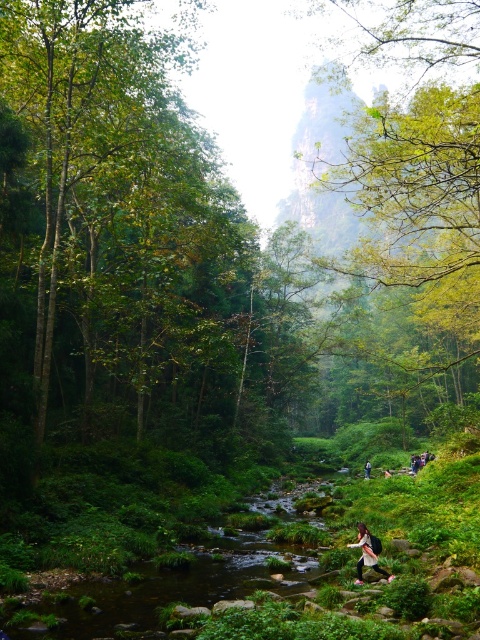
Question: Can you confirm if dark brown leather backpack at lower center is bigger than dark blue jeans at lower center?

Choices:
 (A) yes
 (B) no

Answer: (B)

Question: Among these points, which one is nearest to the camera?

Choices:
 (A) (363, 547)
 (B) (368, 477)

Answer: (A)

Question: Considering the relative positions of dark brown leather backpack at lower center and dark blue jeans at lower center in the image provided, where is dark brown leather backpack at lower center located with respect to dark blue jeans at lower center?

Choices:
 (A) below
 (B) above

Answer: (B)

Question: Does dark brown leather backpack at lower center come in front of dark blue jeans at lower center?

Choices:
 (A) yes
 (B) no

Answer: (A)

Question: Among these objects, which one is farthest from the camera?

Choices:
 (A) dark brown leather backpack at lower center
 (B) dark blue jeans at lower center

Answer: (B)

Question: Which of the following is the farthest from the observer?

Choices:
 (A) (376, 560)
 (B) (364, 472)

Answer: (B)